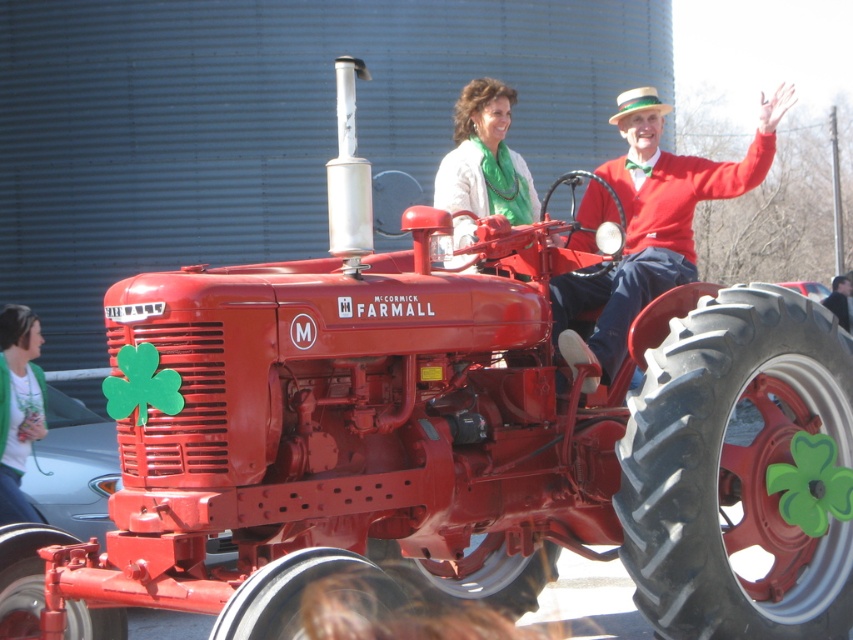
Question: Can you confirm if matte green scarf at center is positioned to the right of green knitted sweater at lower left?

Choices:
 (A) no
 (B) yes

Answer: (B)

Question: Which of the following is the farthest from the observer?

Choices:
 (A) (492, 157)
 (B) (3, 353)
 (C) (619, 157)

Answer: (C)

Question: Can you confirm if red wool sweater at center is positioned to the right of green knitted sweater at lower left?

Choices:
 (A) no
 (B) yes

Answer: (B)

Question: Among these points, which one is farthest from the camera?

Choices:
 (A) (566, 292)
 (B) (21, 512)
 (C) (469, 92)

Answer: (C)

Question: Considering the real-world distances, which object is closest to the matte green scarf at center?

Choices:
 (A) green knitted sweater at lower left
 (B) red wool sweater at center

Answer: (A)

Question: Can you confirm if red wool sweater at center is bigger than green knitted sweater at lower left?

Choices:
 (A) no
 (B) yes

Answer: (B)